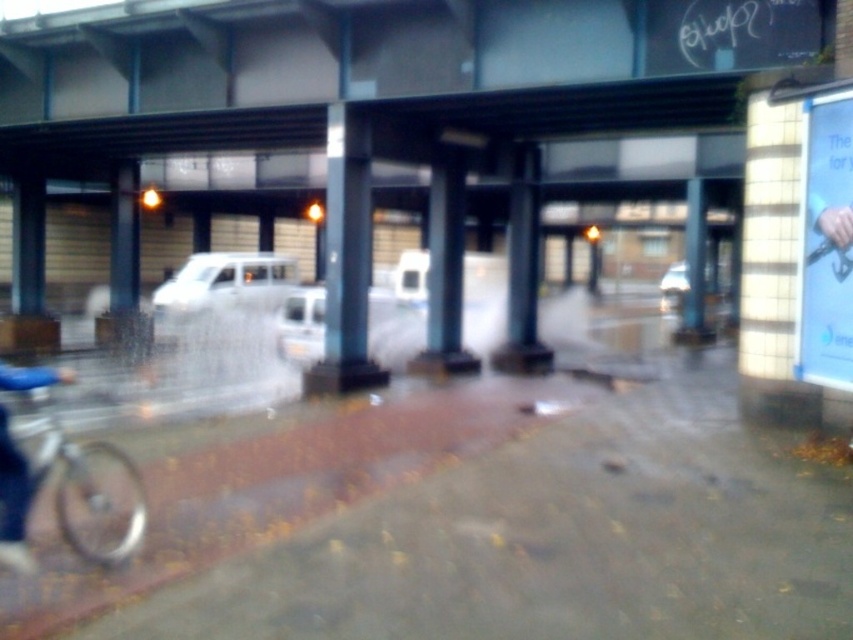
Question: Is white matte van at center wider than white glossy van at center?

Choices:
 (A) yes
 (B) no

Answer: (A)

Question: Among these objects, which one is nearest to the camera?

Choices:
 (A) white matte van at center
 (B) white glossy van at center
 (C) silver metallic bicycle at lower left

Answer: (C)

Question: Observing the image, what is the correct spatial positioning of silver metallic bicycle at lower left in reference to white glossy van at center?

Choices:
 (A) above
 (B) below

Answer: (B)

Question: Does white matte van at center have a lesser width compared to white glossy van at center?

Choices:
 (A) no
 (B) yes

Answer: (A)

Question: Which point is farther to the camera?

Choices:
 (A) silver metallic bicycle at lower left
 (B) white glossy van at center
 (C) white matte van at center

Answer: (C)

Question: Based on their relative distances, which object is farther from the silver metallic bicycle at lower left?

Choices:
 (A) white matte van at center
 (B) white glossy van at center

Answer: (A)